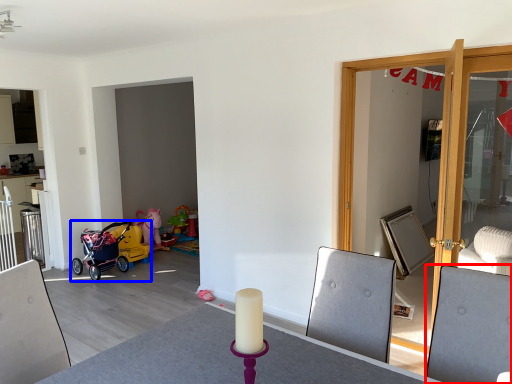
Question: Which point is closer to the camera, swivel chair (highlighted by a red box) or stroller (highlighted by a blue box)?

Choices:
 (A) swivel chair
 (B) stroller

Answer: (A)